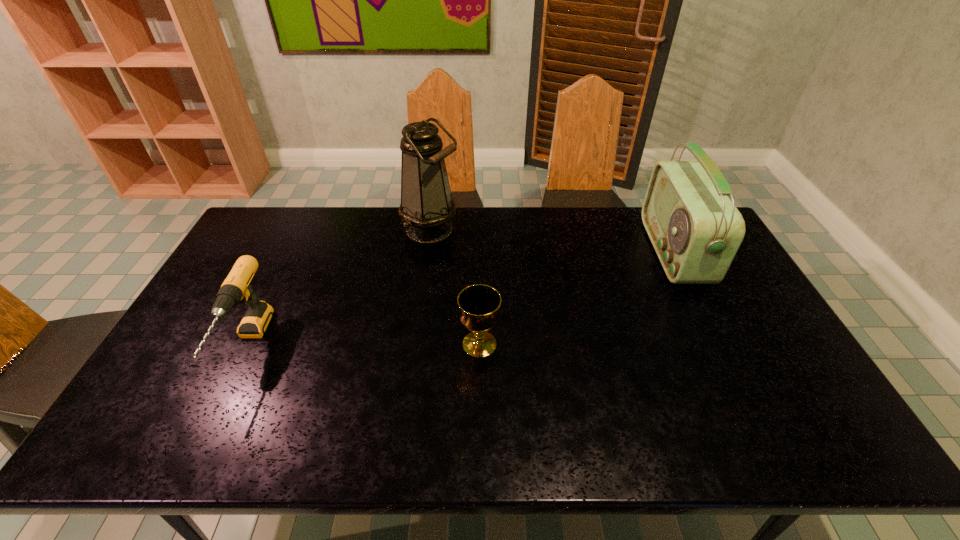
The width and height of the screenshot is (960, 540). I want to click on object that ranks as the third closest to the leftmost object, so click(x=695, y=229).

Identify which object is located as the nearest to the leftmost object. Please provide its 2D coordinates. Your answer should be formatted as a tuple, i.e. [(x, y)], where the tuple contains the x and y coordinates of a point satisfying the conditions above.

[(427, 206)]

Identify the location of free space in the image that satisfies the following two spatial constraints: 1. on the front panel of the radio receiver; 2. on the handle side of the drill. (720, 345).